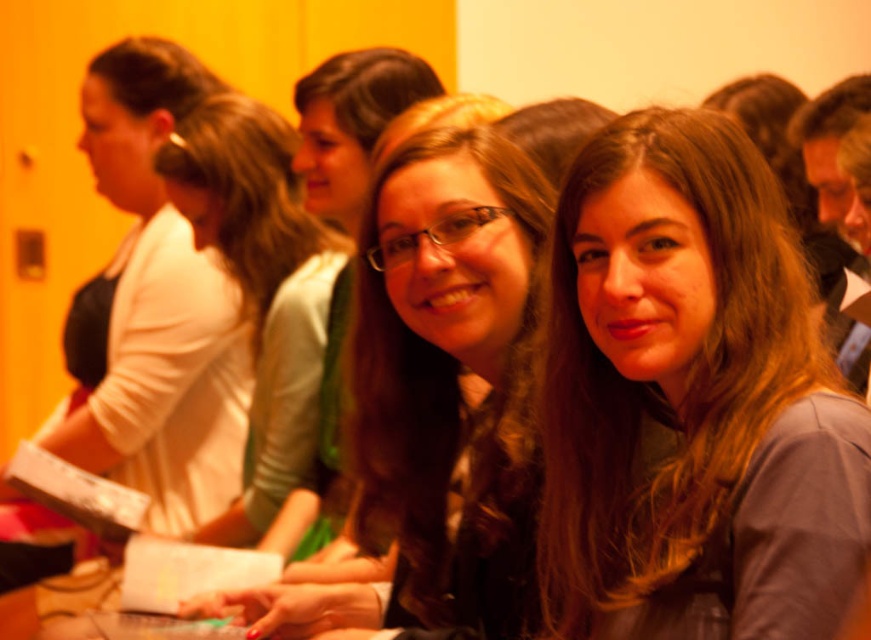
Based on the photo, who is more forward, (x=352, y=596) or (x=111, y=330)?

Point (x=352, y=596) is in front.

Who is more distant from viewer, (485, 509) or (187, 477)?

Point (187, 477)

Between point (481, 580) and point (219, 461), which one is positioned in front?

Point (481, 580)

In order to click on matte black hair at center in this screenshot , I will do `click(450, 376)`.

From the picture: Is brown hair at center wider than white matte jacket at upper left?

In fact, brown hair at center might be narrower than white matte jacket at upper left.

Between brown hair at center and white matte jacket at upper left, which one has more height?

white matte jacket at upper left

Is point (684, 611) positioned behind point (89, 426)?

No.

You are a GUI agent. You are given a task and a screenshot of the screen. Output one action in this format:
    pyautogui.click(x=<x>, y=<y>)
    Task: Click on the brown hair at center
    Image resolution: width=871 pixels, height=640 pixels.
    Given the screenshot: What is the action you would take?
    pyautogui.click(x=691, y=397)

Is brown hair at center below matte black hair at center?

No.

The image size is (871, 640). What do you see at coordinates (691, 397) in the screenshot?
I see `brown hair at center` at bounding box center [691, 397].

Is point (588, 333) farther from viewer compared to point (444, 163)?

That is False.

Locate an element on the screen. Image resolution: width=871 pixels, height=640 pixels. brown hair at center is located at coordinates (691, 397).